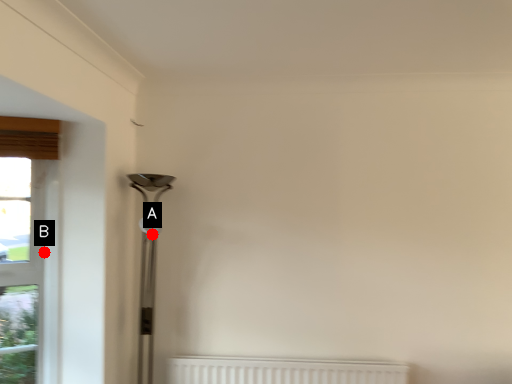
Question: Two points are circled on the image, labeled by A and B beside each circle. Among these points, which one is nearest to the camera?

Choices:
 (A) A is closer
 (B) B is closer

Answer: (B)